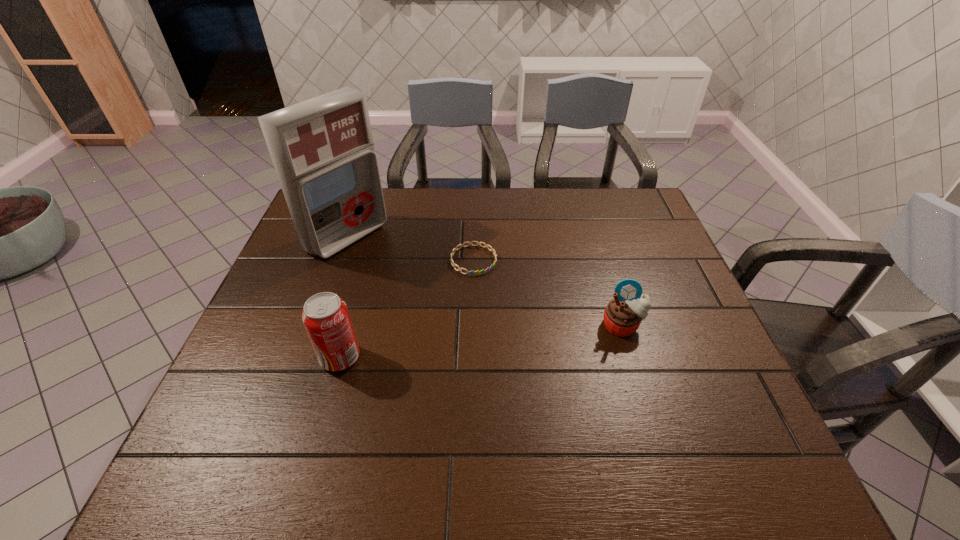
Locate an element on the screen. Image resolution: width=960 pixels, height=540 pixels. vacant space located on the front-facing side of the rightmost object is located at coordinates (634, 360).

Identify the location of vacant area located 0.360m on the front-facing side of the tallest object. Image resolution: width=960 pixels, height=540 pixels. (463, 312).

Where is `vacant space located 0.280m on the front-facing side of the tallest object`? The height and width of the screenshot is (540, 960). vacant space located 0.280m on the front-facing side of the tallest object is located at coordinates (441, 298).

Where is `vacant space located on the front-facing side of the tallest object`? Image resolution: width=960 pixels, height=540 pixels. vacant space located on the front-facing side of the tallest object is located at coordinates (460, 310).

The width and height of the screenshot is (960, 540). What are the coordinates of `vacant space located on the surface of the bracelet showing star-shaped elements` in the screenshot? It's located at (492, 286).

What are the coordinates of `free space located 0.320m on the surface of the bracelet showing star-shaped elements` in the screenshot? It's located at [544, 359].

Identify the location of free point located 0.050m on the surface of the bracelet showing star-shaped elements. (492, 286).

Locate an element on the screen. This screenshot has width=960, height=540. object positioned at the far edge is located at coordinates coord(322,149).

Where is `object situated at the left edge`? object situated at the left edge is located at coordinates (322, 149).

The height and width of the screenshot is (540, 960). What are the coordinates of `object at the right edge` in the screenshot? It's located at (622, 316).